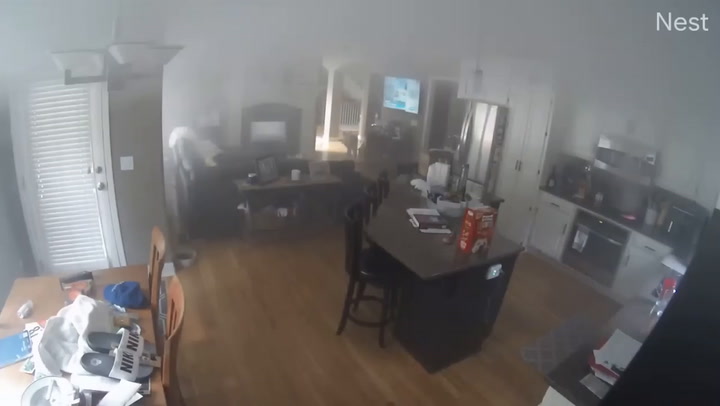
Locate an element on the screen. The width and height of the screenshot is (720, 406). wall is located at coordinates (163, 154).